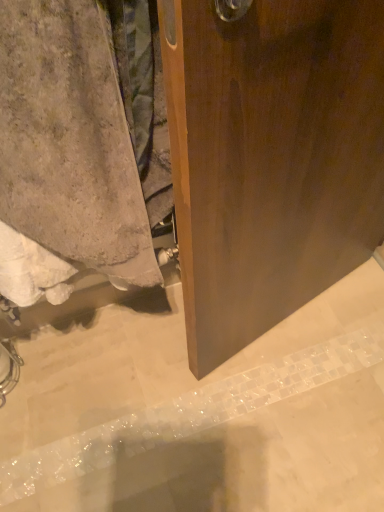
Question: Could you tell me if beige textured towel at lower left is facing gray concrete at lower left?

Choices:
 (A) yes
 (B) no

Answer: (B)

Question: Is the position of beige textured towel at lower left more distant than that of gray concrete at lower left?

Choices:
 (A) yes
 (B) no

Answer: (B)

Question: Is beige textured towel at lower left looking in the opposite direction of gray concrete at lower left?

Choices:
 (A) yes
 (B) no

Answer: (B)

Question: Does beige textured towel at lower left have a larger size compared to gray concrete at lower left?

Choices:
 (A) no
 (B) yes

Answer: (B)

Question: From the image's perspective, would you say beige textured towel at lower left is shown under gray concrete at lower left?

Choices:
 (A) no
 (B) yes

Answer: (A)

Question: Does beige textured towel at lower left have a lesser width compared to gray concrete at lower left?

Choices:
 (A) no
 (B) yes

Answer: (B)

Question: Does gray concrete at lower left have a greater height compared to beige textured towel at lower left?

Choices:
 (A) no
 (B) yes

Answer: (A)

Question: Is gray concrete at lower left bigger than beige textured towel at lower left?

Choices:
 (A) yes
 (B) no

Answer: (B)

Question: From a real-world perspective, is gray concrete at lower left over beige textured towel at lower left?

Choices:
 (A) yes
 (B) no

Answer: (B)

Question: From the image's perspective, does gray concrete at lower left appear higher than beige textured towel at lower left?

Choices:
 (A) no
 (B) yes

Answer: (A)

Question: Is gray concrete at lower left looking in the opposite direction of beige textured towel at lower left?

Choices:
 (A) no
 (B) yes

Answer: (A)

Question: Can beige textured towel at lower left be found inside gray concrete at lower left?

Choices:
 (A) yes
 (B) no

Answer: (B)

Question: From the image's perspective, is gray concrete at lower left located above or below beige textured towel at lower left?

Choices:
 (A) below
 (B) above

Answer: (A)